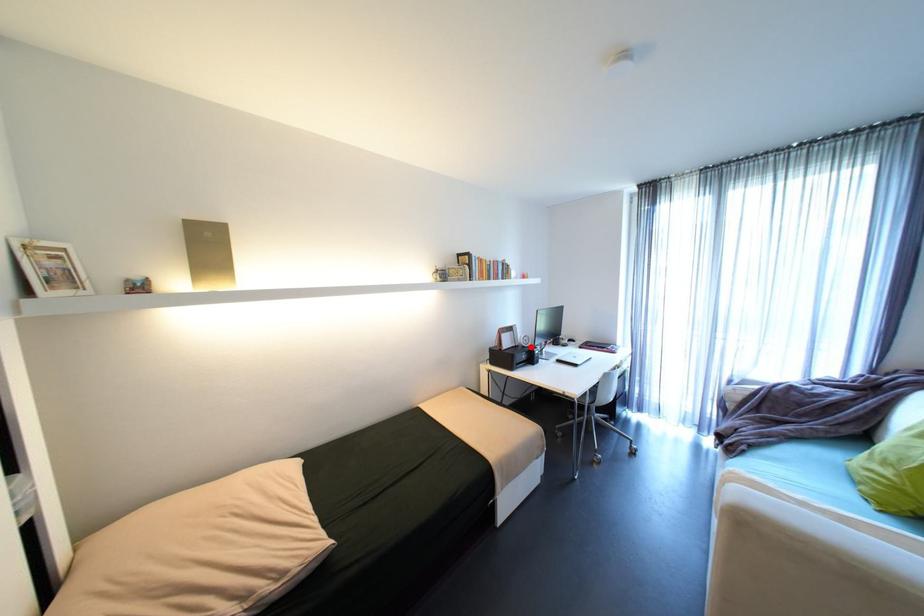
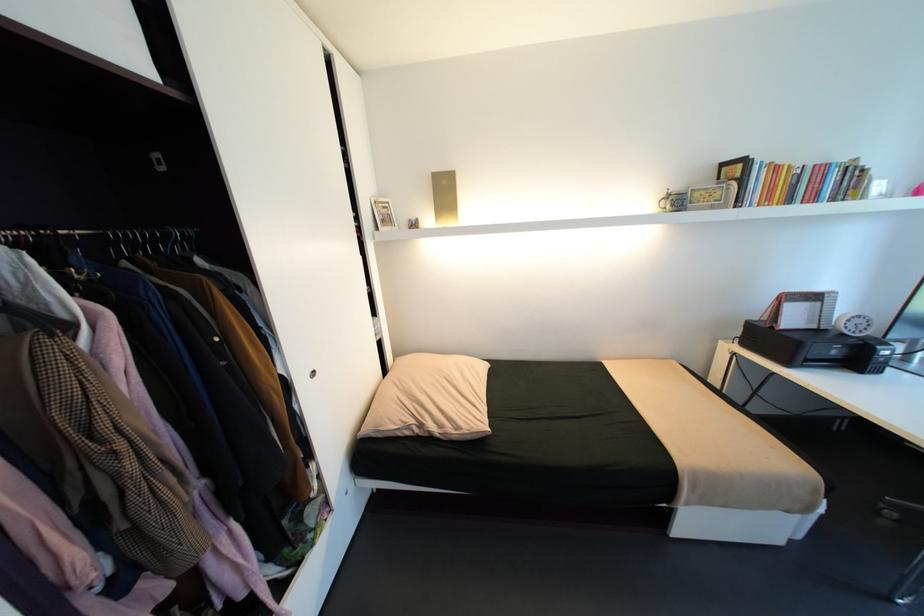
In the second image, find the point that corresponds to the highlighted location in the first image.

(850, 334)